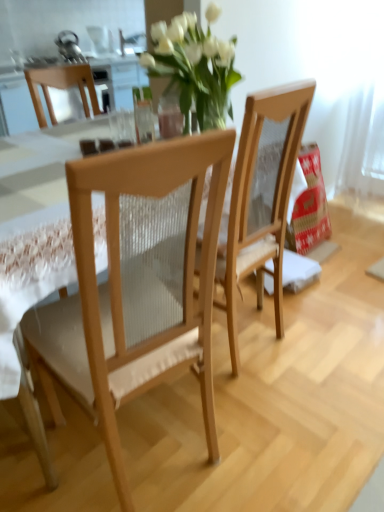
The image size is (384, 512). I want to click on vacant area that lies to the right of natural wood chair at center, marked as the 1th chair in a right-to-left arrangement, so click(x=316, y=342).